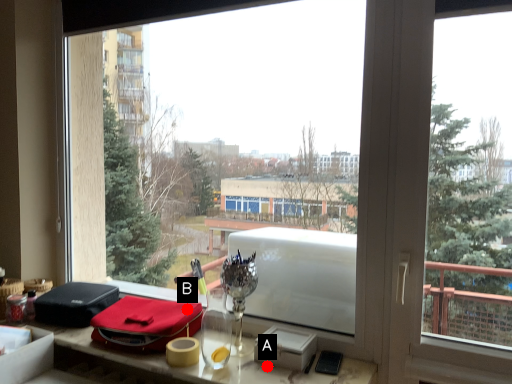
Question: Two points are circled on the image, labeled by A and B beside each circle. Which of the following is the closest to the observer?

Choices:
 (A) A is closer
 (B) B is closer

Answer: (A)